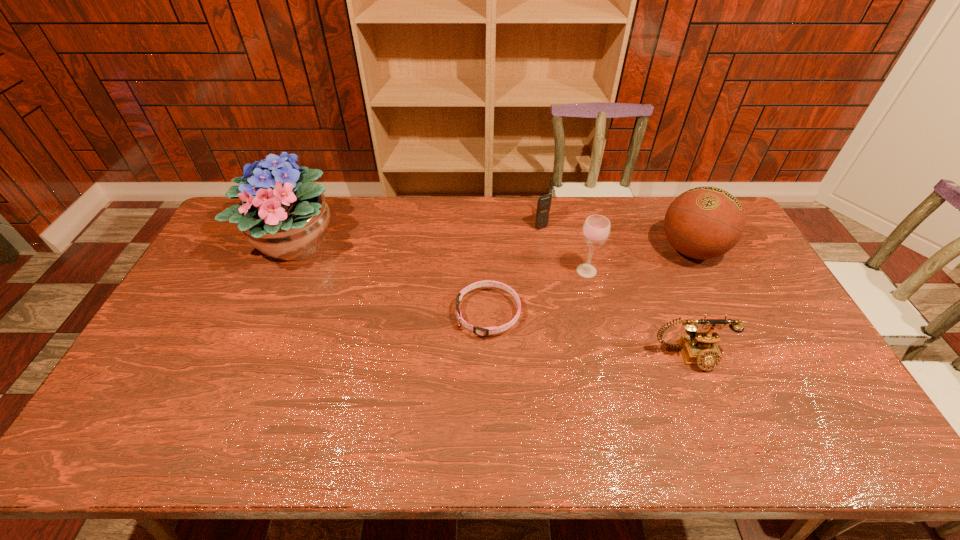
Where is `bouquet`? bouquet is located at coordinates (282, 214).

This screenshot has height=540, width=960. In order to click on the leftmost object in this screenshot , I will do `click(282, 214)`.

The width and height of the screenshot is (960, 540). Find the location of `basketball`. basketball is located at coordinates (705, 222).

This screenshot has height=540, width=960. Find the location of `the fourth object from left to right`. the fourth object from left to right is located at coordinates (596, 229).

Image resolution: width=960 pixels, height=540 pixels. In order to click on wineglass in this screenshot , I will do `click(596, 229)`.

Identify the location of cellular telephone. This screenshot has height=540, width=960. (544, 202).

Where is `the fifth tallest object`? Image resolution: width=960 pixels, height=540 pixels. the fifth tallest object is located at coordinates (700, 348).

Locate an element on the screen. dog collar is located at coordinates (485, 331).

Identify the location of the shortest object. This screenshot has height=540, width=960. (485, 331).

In order to click on vacant space situated 0.170m on the right of the tallest object in this screenshot , I will do `click(390, 243)`.